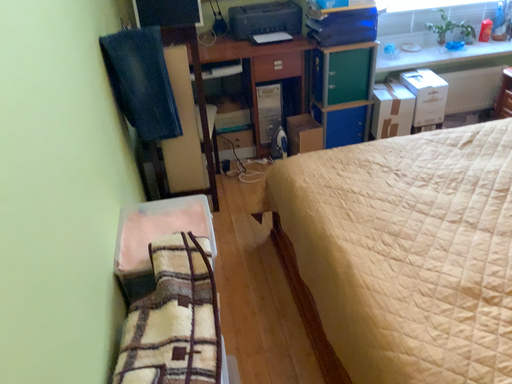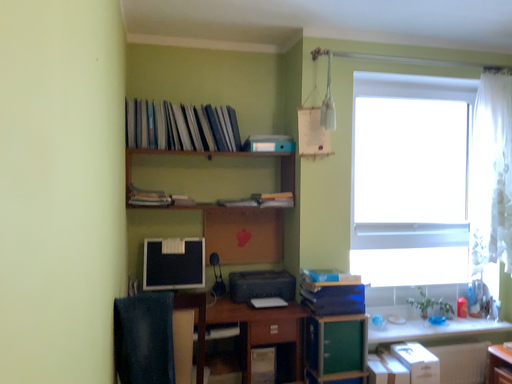
Question: Which way did the camera rotate in the video?

Choices:
 (A) rotated upward
 (B) rotated downward

Answer: (A)